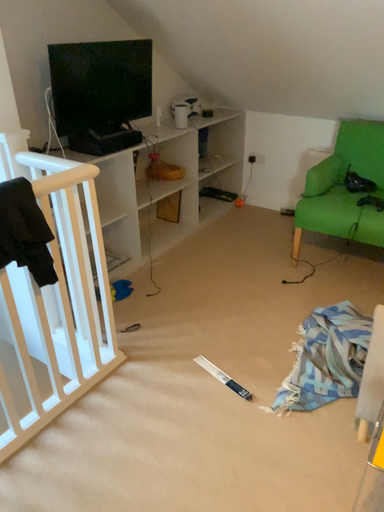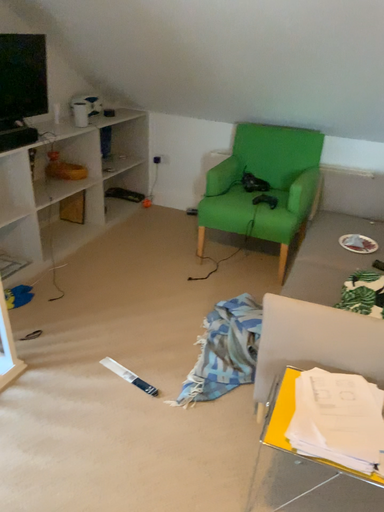
Question: Which way did the camera rotate in the video?

Choices:
 (A) rotated right
 (B) rotated left

Answer: (A)